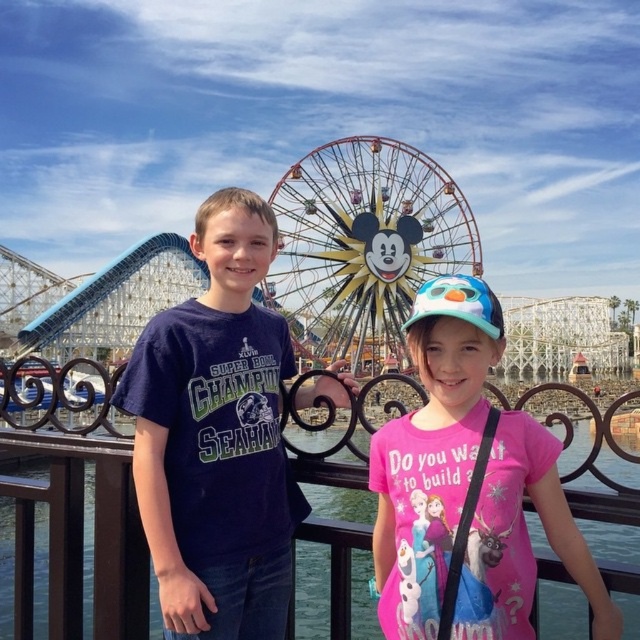
Question: Can you confirm if pink fabric shirt at center is positioned to the left of black metal railing at center?

Choices:
 (A) yes
 (B) no

Answer: (B)

Question: Does metallic/reflective ferris wheel at center appear under black metal railing at center?

Choices:
 (A) yes
 (B) no

Answer: (B)

Question: Among these points, which one is farthest from the camera?

Choices:
 (A) (60, 557)
 (B) (378, 572)
 (C) (432, 236)
 (D) (241, 420)

Answer: (C)

Question: Which point is closer to the camera taking this photo?

Choices:
 (A) (417, 228)
 (B) (74, 362)
 (C) (246, 221)
 (D) (404, 586)

Answer: (D)

Question: Can you confirm if metallic/reflective ferris wheel at center is positioned to the left of black metal railing at center?

Choices:
 (A) yes
 (B) no

Answer: (B)

Question: Which point is closer to the camera?

Choices:
 (A) (390, 266)
 (B) (458, 408)

Answer: (B)